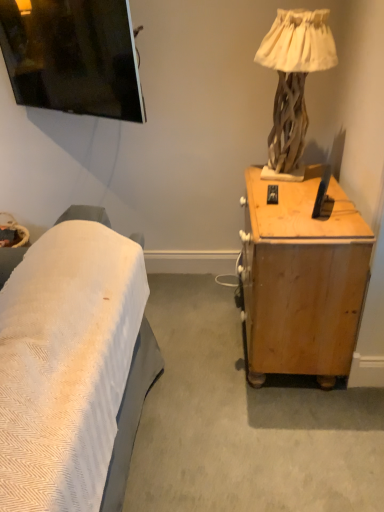
The image size is (384, 512). Identify the location of free spot above wooden desk at right (from a real-world perspective). (294, 204).